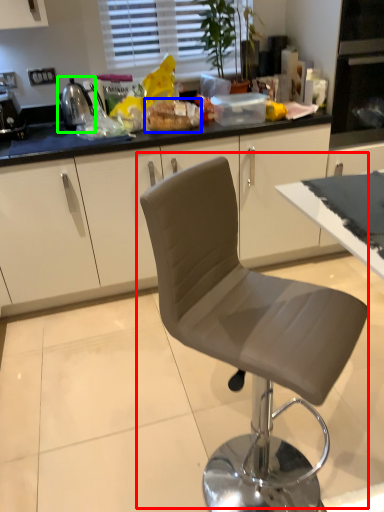
Question: Which object is the farthest from chair (highlighted by a red box)? Choose among these: food (highlighted by a blue box) or appliance (highlighted by a green box).

Choices:
 (A) food
 (B) appliance

Answer: (B)